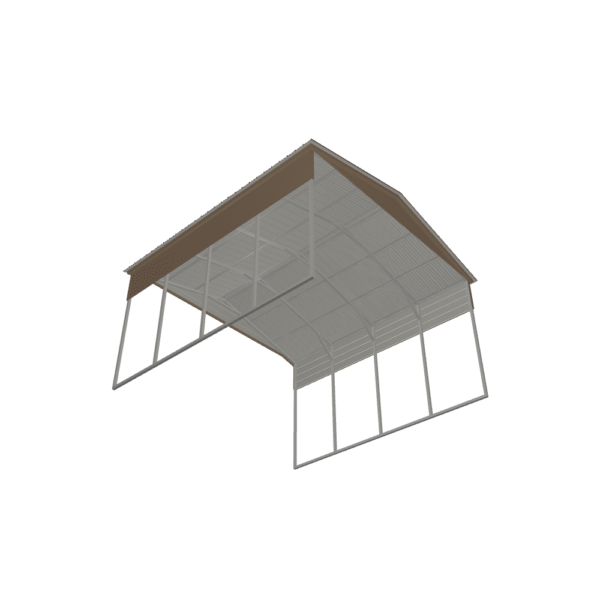
Where is `support beam`? The image size is (600, 600). support beam is located at coordinates (349, 235), (329, 283), (295, 312), (254, 328).